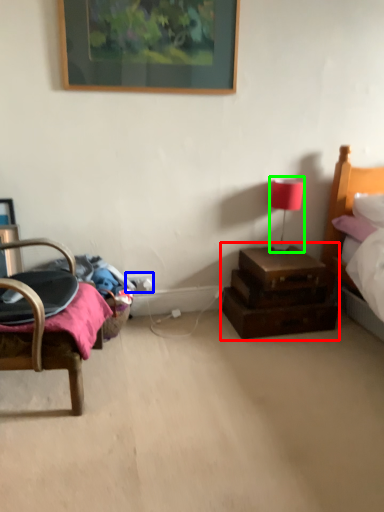
Question: Considering the real-world distances, which object is closest to nightstand (highlighted by a red box)? electric outlet (highlighted by a blue box) or table lamp (highlighted by a green box).

Choices:
 (A) electric outlet
 (B) table lamp

Answer: (B)